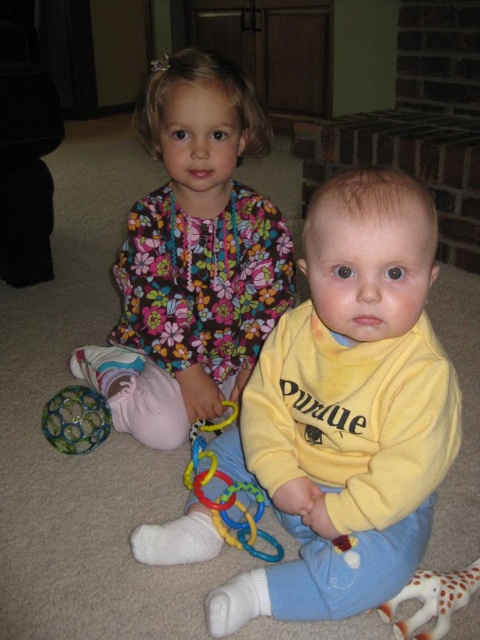
Is white rubber giraffe at lower right bigger than multicolored plastic ball at lower left?

No, white rubber giraffe at lower right is not bigger than multicolored plastic ball at lower left.

Which is in front, point (444, 577) or point (96, 404)?

Positioned in front is point (444, 577).

The image size is (480, 640). In order to click on white rubber giraffe at lower right in this screenshot , I will do (432, 600).

Is rubber rings at center wider than white rubber giraffe at lower right?

Yes.

Looking at this image, can you confirm if rubber rings at center is positioned above white rubber giraffe at lower right?

Indeed, rubber rings at center is positioned over white rubber giraffe at lower right.

Is point (194, 460) farther from camera compared to point (448, 608)?

Yes, it is behind point (448, 608).

The width and height of the screenshot is (480, 640). In order to click on rubber rings at center in this screenshot , I will do `click(228, 500)`.

Which of these two, yellow fleece sweater at center or white rubber giraffe at lower right, stands shorter?

white rubber giraffe at lower right

Which of these two, yellow fleece sweater at center or white rubber giraffe at lower right, stands taller?

Standing taller between the two is yellow fleece sweater at center.

What do you see at coordinates (347, 410) in the screenshot?
I see `yellow fleece sweater at center` at bounding box center [347, 410].

The width and height of the screenshot is (480, 640). I want to click on yellow fleece sweater at center, so click(x=347, y=410).